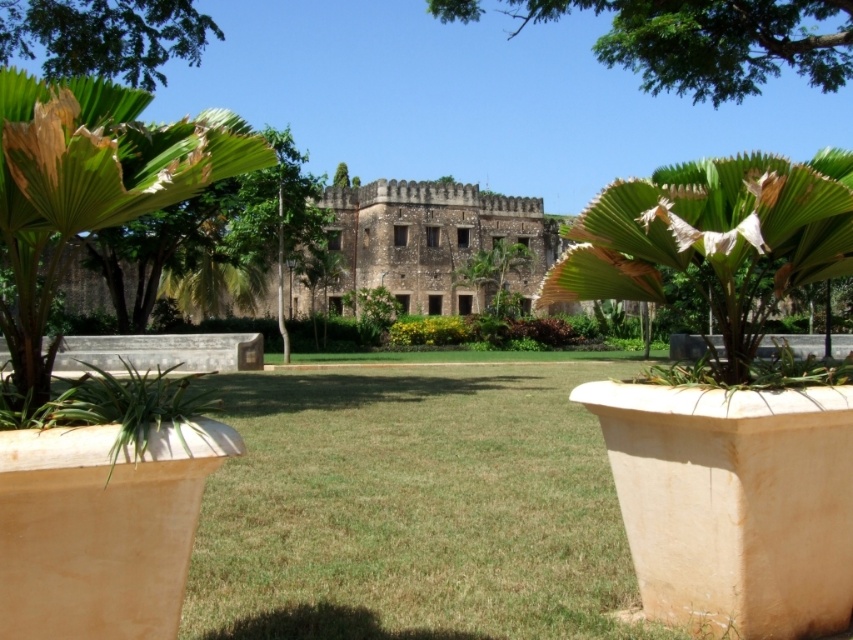
Is green leafy palm at center taller than green leafy palm at left?

Incorrect, green leafy palm at center's height is not larger of green leafy palm at left's.

Who is shorter, green leafy palm at center or green leafy palm at left?

With less height is green leafy palm at center.

Is point (693, 266) closer to camera compared to point (253, 156)?

That is False.

Locate an element on the screen. This screenshot has width=853, height=640. green leafy palm at center is located at coordinates (714, 241).

Does point (26, 371) come behind point (755, 45)?

No.

Can you confirm if green leafy palm at left is positioned below green leafy tree at upper center?

Indeed, green leafy palm at left is positioned under green leafy tree at upper center.

Find the location of `green leafy palm at left`. green leafy palm at left is located at coordinates (86, 188).

Between green leafy tree at upper center and green leafy tree at upper left, which one appears on the right side from the viewer's perspective?

From the viewer's perspective, green leafy tree at upper center appears more on the right side.

Can you confirm if green leafy tree at upper center is taller than green leafy tree at upper left?

Correct, green leafy tree at upper center is much taller as green leafy tree at upper left.

At what (x,y) coordinates should I click in order to perform the action: click on green leafy tree at upper center. Please return your answer as a coordinate pair (x, y). Looking at the image, I should click on (711, 42).